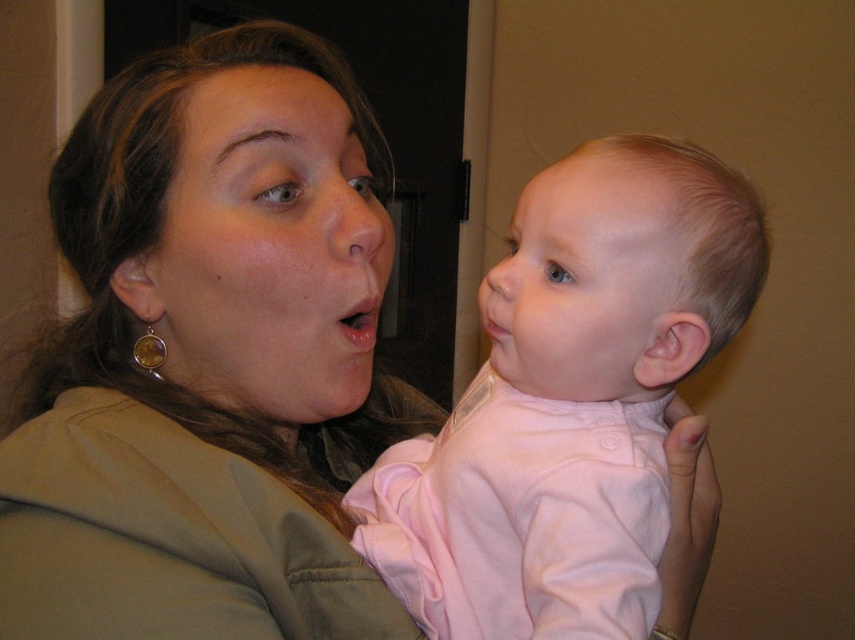
The image size is (855, 640). What are the coordinates of `matte green jacket at upper left` in the screenshot? It's located at (208, 358).

Can you confirm if matte green jacket at upper left is smaller than matte pink lips at center?

Incorrect, matte green jacket at upper left is not smaller in size than matte pink lips at center.

Who is more distant from viewer, (378,406) or (357,314)?

The point (378,406) is behind.

Identify the location of matte green jacket at upper left. This screenshot has width=855, height=640. (208, 358).

Is pink fabric baby at center behind matte pink lips at center?

That is False.

Is point (637, 269) closer to camera compared to point (363, 300)?

Yes, it is in front of point (363, 300).

I want to click on pink fabric baby at center, so click(569, 403).

Is matte green jacket at upper left taller than pink fabric baby at center?

Indeed, matte green jacket at upper left has a greater height compared to pink fabric baby at center.

Which of these two, matte green jacket at upper left or pink fabric baby at center, stands shorter?

pink fabric baby at center

This screenshot has height=640, width=855. I want to click on matte green jacket at upper left, so click(208, 358).